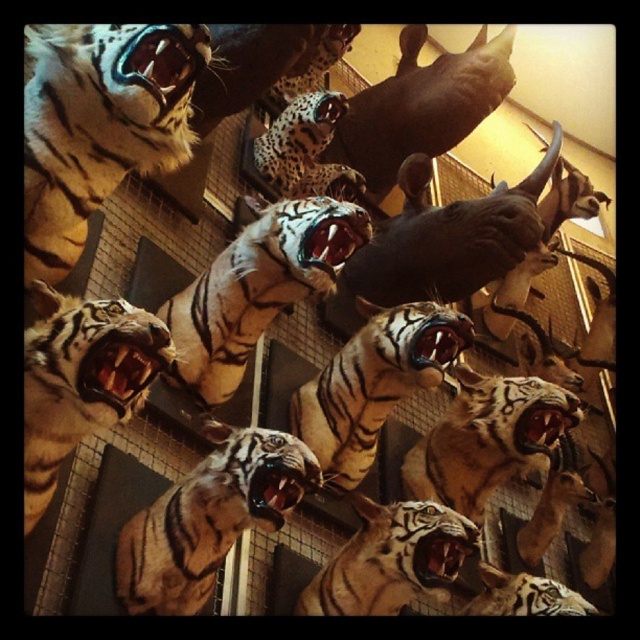
Is shiny golden tiger at center thinner than shiny orange tiger at center?

Indeed, shiny golden tiger at center has a lesser width compared to shiny orange tiger at center.

Does shiny golden tiger at center have a smaller size compared to shiny orange tiger at center?

Correct, shiny golden tiger at center occupies less space than shiny orange tiger at center.

Locate an element on the screen. This screenshot has width=640, height=640. shiny golden tiger at center is located at coordinates (209, 516).

Where is `shiny golden tiger at center`? This screenshot has height=640, width=640. shiny golden tiger at center is located at coordinates (209, 516).